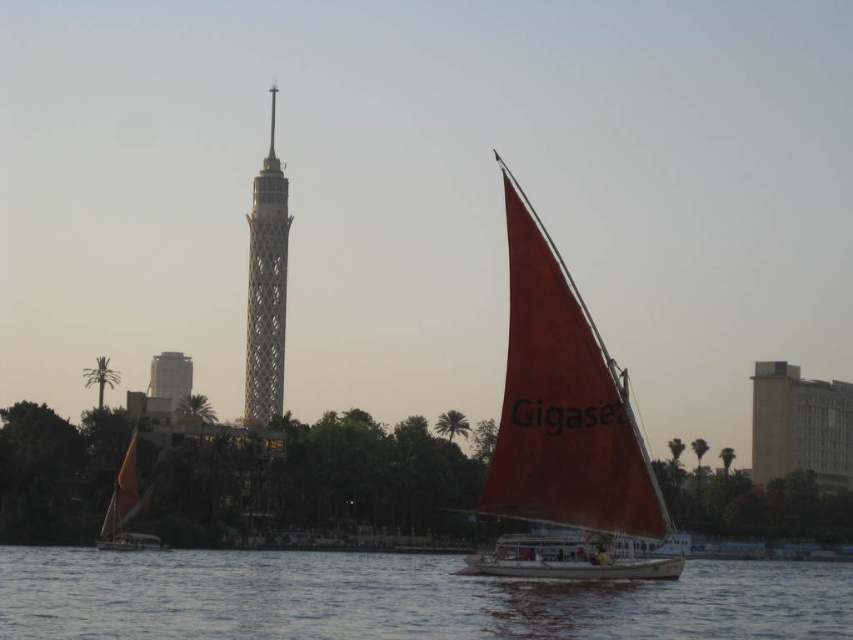
How far apart are matte red sail at right and metallic lattice tower at center?

The distance of matte red sail at right from metallic lattice tower at center is 319.18 meters.

What do you see at coordinates (564, 429) in the screenshot?
I see `matte red sail at right` at bounding box center [564, 429].

Locate an element on the screen. matte red sail at right is located at coordinates (564, 429).

Measure the distance from blue water at lower center to metallic lattice tower at center.

blue water at lower center is 154.16 meters from metallic lattice tower at center.

Can you confirm if blue water at lower center is shorter than metallic lattice tower at center?

Yes, blue water at lower center is shorter than metallic lattice tower at center.

Which is behind, point (689, 566) or point (252, 360)?

Positioned behind is point (252, 360).

Locate an element on the screen. The height and width of the screenshot is (640, 853). blue water at lower center is located at coordinates (399, 598).

Does blue water at lower center have a greater height compared to matte red sail at right?

No.

Is point (805, 616) in front of point (514, 513)?

No, it is not.

Is point (173, 592) behind point (564, 394)?

Yes, it is behind point (564, 394).

The image size is (853, 640). In order to click on blue water at lower center in this screenshot , I will do `click(399, 598)`.